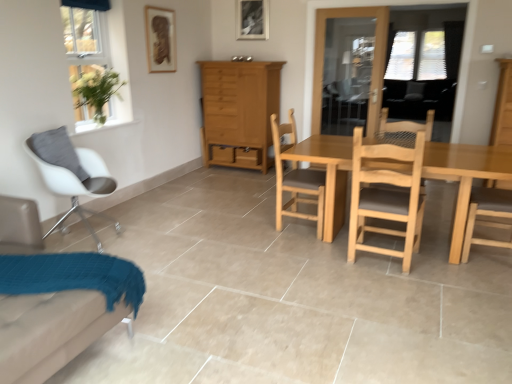
What do you see at coordinates (386, 194) in the screenshot?
I see `natural wood chair at center, positioned as the first chair in right-to-left order` at bounding box center [386, 194].

What do you see at coordinates (99, 52) in the screenshot? This screenshot has width=512, height=384. I see `clear glass window at upper left` at bounding box center [99, 52].

Describe the element at coordinates (465, 176) in the screenshot. This screenshot has height=384, width=512. I see `light brown wooden table at center right` at that location.

This screenshot has width=512, height=384. What do you see at coordinates (376, 38) in the screenshot?
I see `transparent glass door at upper right` at bounding box center [376, 38].

What do you see at coordinates (239, 112) in the screenshot?
I see `light brown wood cabinet at center` at bounding box center [239, 112].

Where is `metallic silver picture frame at upper center, the 2th picture frame in the bottom-to-top sequence`? The height and width of the screenshot is (384, 512). metallic silver picture frame at upper center, the 2th picture frame in the bottom-to-top sequence is located at coordinates (252, 19).

Describe the element at coordinates (503, 107) in the screenshot. I see `light wood dresser at right` at that location.

Locate an element on the screen. The image size is (512, 384). light brown wood chair at center, placed as the second chair when sorted from right to left is located at coordinates (296, 179).

The width and height of the screenshot is (512, 384). What are the coordinates of `natural wood chair at center, marked as the fourth chair in a left-to-right arrangement` in the screenshot? It's located at (386, 194).

Does white matte chair at left, which is the fourth chair in right-to-left order, have a greater width compared to light brown wooden table at center right?

No, white matte chair at left, which is the fourth chair in right-to-left order, is not wider than light brown wooden table at center right.

Can you confirm if white matte chair at left, which is the fourth chair in right-to-left order, is taller than light brown wooden table at center right?

Yes, white matte chair at left, which is the fourth chair in right-to-left order, is taller than light brown wooden table at center right.

Is light brown wooden table at center right surrounded by white matte chair at left, which is the fourth chair in right-to-left order?

No, light brown wooden table at center right is not inside white matte chair at left, which is the fourth chair in right-to-left order.

Are white matte chair at left, which appears as the first chair when viewed from the left, and light brown wooden table at center right beside each other?

No, white matte chair at left, which appears as the first chair when viewed from the left, is not next to light brown wooden table at center right.

Is metallic silver picture frame at upper center, which is the 1th picture frame in back-to-front order, positioned beyond the bounds of matte brown picture frame at upper center, which is the second picture frame from back to front?

Yes, metallic silver picture frame at upper center, which is the 1th picture frame in back-to-front order, is located beyond the bounds of matte brown picture frame at upper center, which is the second picture frame from back to front.

From the image's perspective, would you say metallic silver picture frame at upper center, placed as the second picture frame when sorted from left to right, is shown under matte brown picture frame at upper center, the 1th picture frame positioned from the front?

No.

How far apart are metallic silver picture frame at upper center, the 1th picture frame positioned from the right, and matte brown picture frame at upper center, marked as the 1th picture frame in a left-to-right arrangement?

metallic silver picture frame at upper center, the 1th picture frame positioned from the right, and matte brown picture frame at upper center, marked as the 1th picture frame in a left-to-right arrangement, are 4.43 feet apart from each other.

Is the depth of metallic silver picture frame at upper center, which is the second picture frame from front to back, less than that of matte brown picture frame at upper center, the 1th picture frame positioned from the front?

That is False.

Is clear glass window at upper left to the right of white fabric chair at lower left, arranged as the second chair when viewed from the left, from the viewer's perspective?

Incorrect, clear glass window at upper left is not on the right side of white fabric chair at lower left, arranged as the second chair when viewed from the left.

Which is in front, point (106, 106) or point (1, 356)?

Positioned in front is point (1, 356).

In order to click on window on the left of white fabric chair at lower left, the 3th chair when ordered from right to left in this screenshot , I will do `click(99, 52)`.

Who is taller, light wood dresser at right or transparent glass door at upper right?

transparent glass door at upper right is taller.

Which is more to the left, light wood dresser at right or transparent glass door at upper right?

transparent glass door at upper right.

Is light wood dresser at right oriented towards transparent glass door at upper right?

No, light wood dresser at right is not turned towards transparent glass door at upper right.

How different are the orientations of light wood dresser at right and transparent glass door at upper right in degrees?

They differ by 1.87 degrees in their facing directions.

Is light wood dresser at right to the left or to the right of transparent glass door at upper right in the image?

light wood dresser at right is to the right of transparent glass door at upper right.

In terms of width, does light wood dresser at right look wider or thinner when compared to transparent glass door at upper right?

Considering their sizes, light wood dresser at right looks broader than transparent glass door at upper right.

You are a GUI agent. You are given a task and a screenshot of the screen. Output one action in this format:
    pyautogui.click(x=<x>, y=<y>)
    Task: Click on the window screen above the light wood dresser at right (from the image's perspective)
    Image resolution: width=512 pixels, height=384 pixels.
    Given the screenshot: What is the action you would take?
    pyautogui.click(x=376, y=38)

Is light wood dresser at right not near transparent glass door at upper right?

Yes, light wood dresser at right is far from transparent glass door at upper right.

Which is less distant, (493,122) or (286,123)?

The point (286,123) is closer to the camera.

How different are the orientations of light wood dresser at right and light brown wood chair at center, the 3th chair in the left-to-right sequence, in degrees?

The angle between the facing direction of light wood dresser at right and the facing direction of light brown wood chair at center, the 3th chair in the left-to-right sequence, is 86.3 degrees.

Can you confirm if light wood dresser at right is thinner than light brown wood chair at center, the 3th chair in the left-to-right sequence?

Incorrect, the width of light wood dresser at right is not less than that of light brown wood chair at center, the 3th chair in the left-to-right sequence.

Considering the points (507, 138) and (158, 31), which point is in front, point (507, 138) or point (158, 31)?

The point (158, 31) is more forward.

Is light wood dresser at right not close to matte brown picture frame at upper center, marked as the 1th picture frame in a left-to-right arrangement?

That's right, there is a large distance between light wood dresser at right and matte brown picture frame at upper center, marked as the 1th picture frame in a left-to-right arrangement.

Between light wood dresser at right and matte brown picture frame at upper center, the 1th picture frame positioned from the front, which one has larger size?

light wood dresser at right.

Which is behind, light wood dresser at right or matte brown picture frame at upper center, which is the 2th picture frame from right to left?

matte brown picture frame at upper center, which is the 2th picture frame from right to left.

Locate an element on the screen. chair that is the 2nd one when counting backward from the light brown wooden table at center right is located at coordinates (71, 175).

Where is `picture frame in front of the metallic silver picture frame at upper center, the 2th picture frame in the bottom-to-top sequence`? This screenshot has height=384, width=512. picture frame in front of the metallic silver picture frame at upper center, the 2th picture frame in the bottom-to-top sequence is located at coordinates (160, 39).

Looking at the image, which one is located further to light brown wood chair at center, placed as the second chair when sorted from right to left, white matte chair at left, which appears as the first chair when viewed from the left, or transparent glass door at upper right?

transparent glass door at upper right.

Which object lies further to the anchor point light brown wooden table at center right, transparent glass door at upper right or light brown wood chair at center, placed as the second chair when sorted from right to left?

transparent glass door at upper right is positioned further to the anchor light brown wooden table at center right.

Looking at the image, which one is located further to light brown wood cabinet at center, light wood dresser at right or transparent glass door at upper right?

light wood dresser at right lies further to light brown wood cabinet at center than the other object.

Which object lies further to the anchor point white fabric chair at lower left, the 3th chair when ordered from right to left, metallic silver picture frame at upper center, placed as the second picture frame when sorted from left to right, or clear glass window at upper left?

metallic silver picture frame at upper center, placed as the second picture frame when sorted from left to right, is further to white fabric chair at lower left, the 3th chair when ordered from right to left.

Estimate the real-world distances between objects in this image. Which object is further from metallic silver picture frame at upper center, placed as the second picture frame when sorted from left to right, white fabric chair at lower left, the 3th chair when ordered from right to left, or transparent glass door at upper right?

white fabric chair at lower left, the 3th chair when ordered from right to left, is positioned further to the anchor metallic silver picture frame at upper center, placed as the second picture frame when sorted from left to right.

Estimate the real-world distances between objects in this image. Which object is further from metallic silver picture frame at upper center, which is the 1th picture frame in top-to-bottom order, white fabric chair at lower left, arranged as the second chair when viewed from the left, or light brown wood chair at center, placed as the second chair when sorted from right to left?

Based on the image, white fabric chair at lower left, arranged as the second chair when viewed from the left, appears to be further to metallic silver picture frame at upper center, which is the 1th picture frame in top-to-bottom order.

From the image, which object appears to be nearer to matte brown picture frame at upper center, which is the second picture frame from back to front, metallic silver picture frame at upper center, which is the second picture frame from front to back, or white matte chair at left, which appears as the first chair when viewed from the left?

Among the two, metallic silver picture frame at upper center, which is the second picture frame from front to back, is located nearer to matte brown picture frame at upper center, which is the second picture frame from back to front.

Based on their spatial positions, is white matte chair at left, which is the fourth chair in right-to-left order, or light brown wood chair at center, the 3th chair in the left-to-right sequence, closer to light wood dresser at right?

light brown wood chair at center, the 3th chair in the left-to-right sequence, lies closer to light wood dresser at right than the other object.

Identify the location of dresser between natural wood chair at center, marked as the fourth chair in a left-to-right arrangement, and transparent glass door at upper right, along the z-axis. The width and height of the screenshot is (512, 384). (503, 107).

This screenshot has width=512, height=384. In order to click on window screen between light brown wooden table at center right and light brown wood cabinet at center from front to back in this screenshot , I will do `click(376, 38)`.

The width and height of the screenshot is (512, 384). I want to click on desk between matte brown picture frame at upper center, which is the second picture frame from back to front, and transparent glass door at upper right, so click(x=465, y=176).

I want to click on glass door located between white fabric chair at lower left, the 3th chair when ordered from right to left, and metallic silver picture frame at upper center, which is the 1th picture frame in back-to-front order, in the depth direction, so click(x=350, y=60).